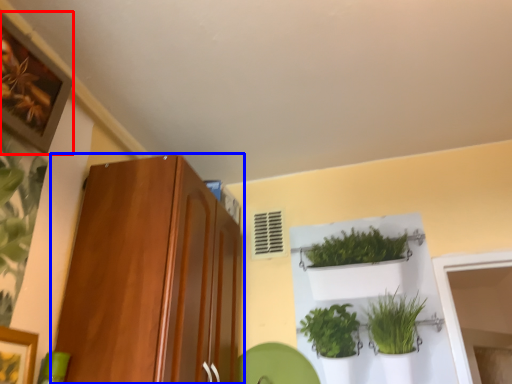
Question: Which object is closer to the camera taking this photo, picture frame (highlighted by a red box) or cabinetry (highlighted by a blue box)?

Choices:
 (A) picture frame
 (B) cabinetry

Answer: (A)